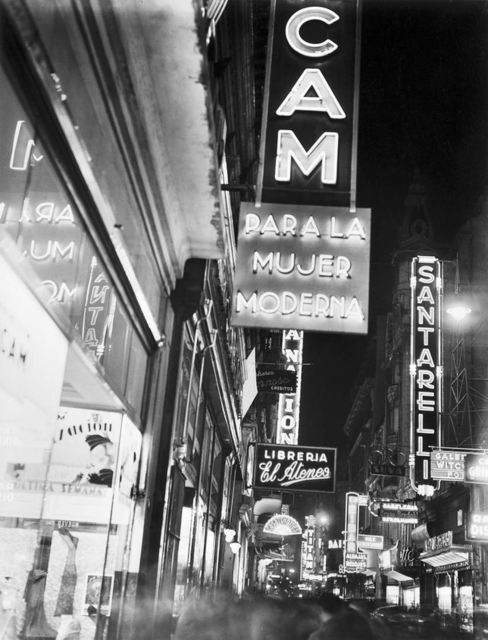
Locate an element on the screen. libreria is located at coordinates (295, 454).